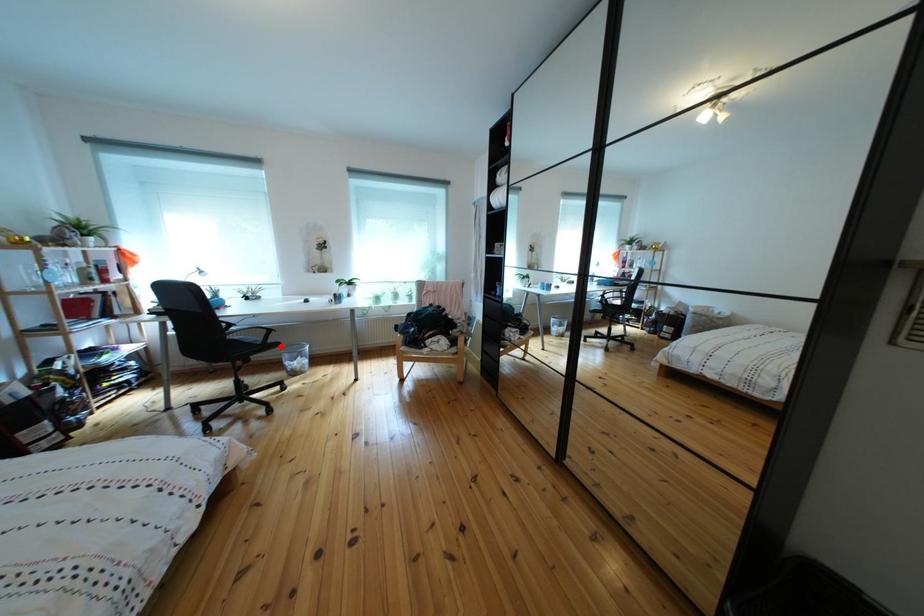
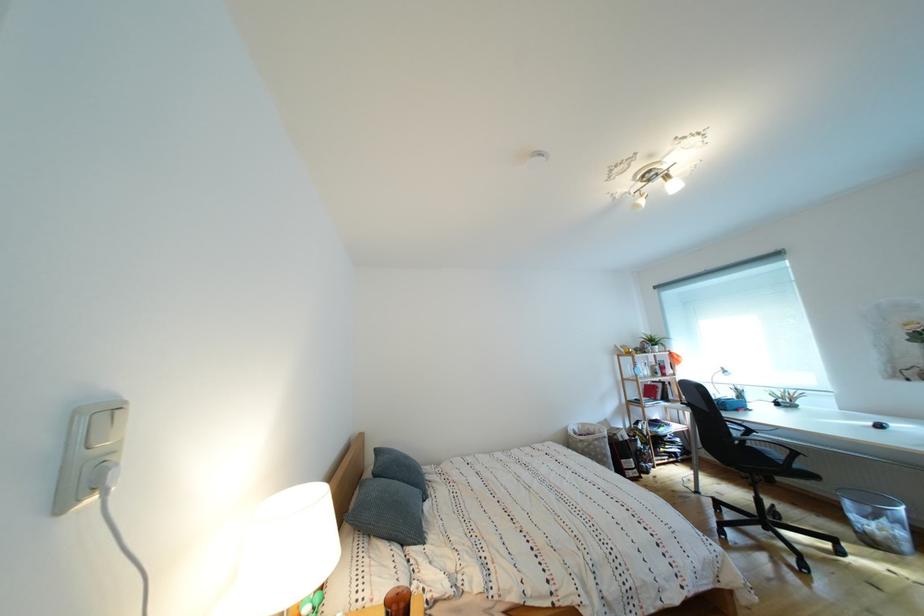
Where in the second image is the point corresponding to the highlighted location from the first image?

(808, 472)